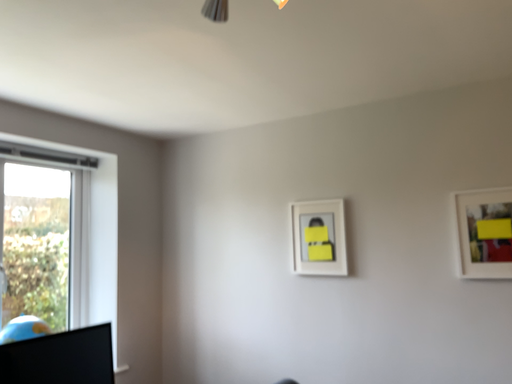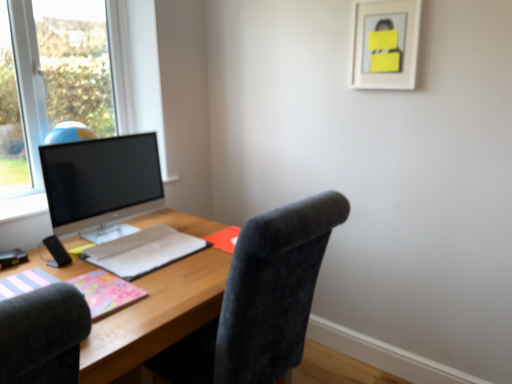
Question: Which way did the camera rotate in the video?

Choices:
 (A) rotated downward
 (B) rotated upward

Answer: (A)